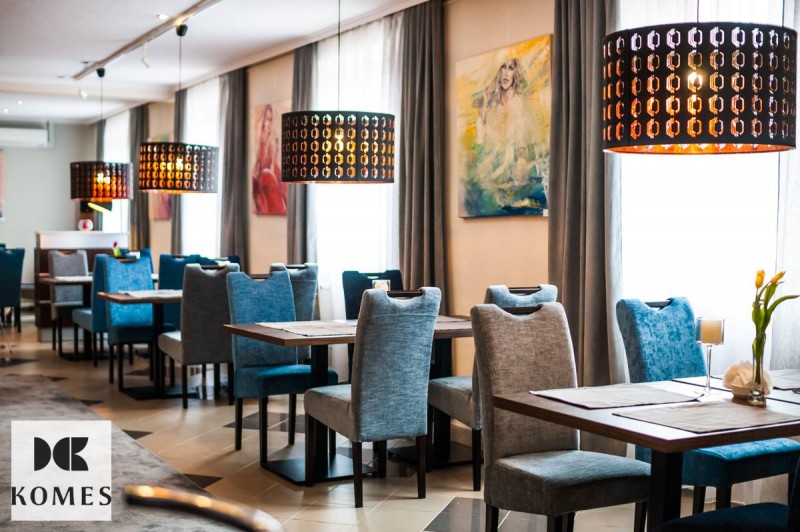
Identify the location of lights. (654, 93), (328, 156), (173, 157), (72, 173).